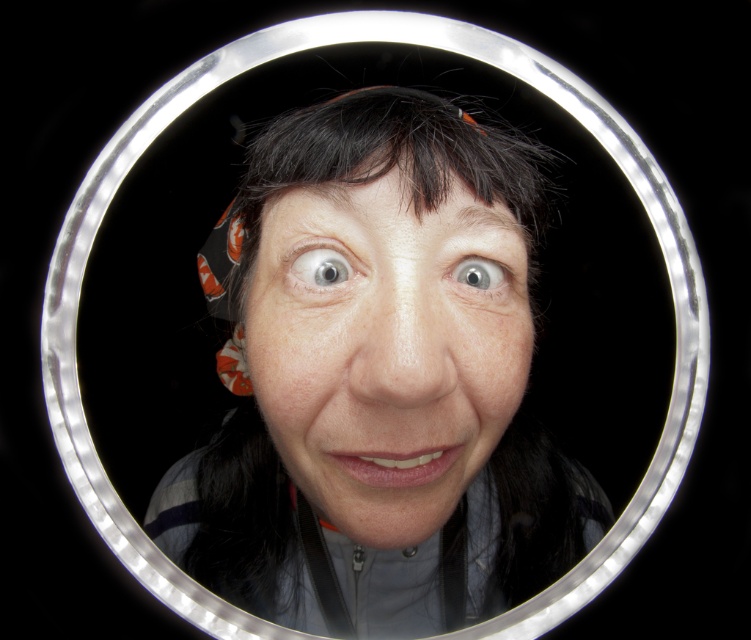
You are an artist analyzing the portrait. You notice the light blue glossy eye at upper center and the gray matte eye at center. Which eye is located higher in the image?

The light blue glossy eye at upper center is positioned higher than the gray matte eye at center.

Looking at the portrait within the circular frame, where is the light blue glossy eye at upper center positioned relative to the gray matte eye at center?

The light blue glossy eye at upper center is positioned to the left of the gray matte eye at center.